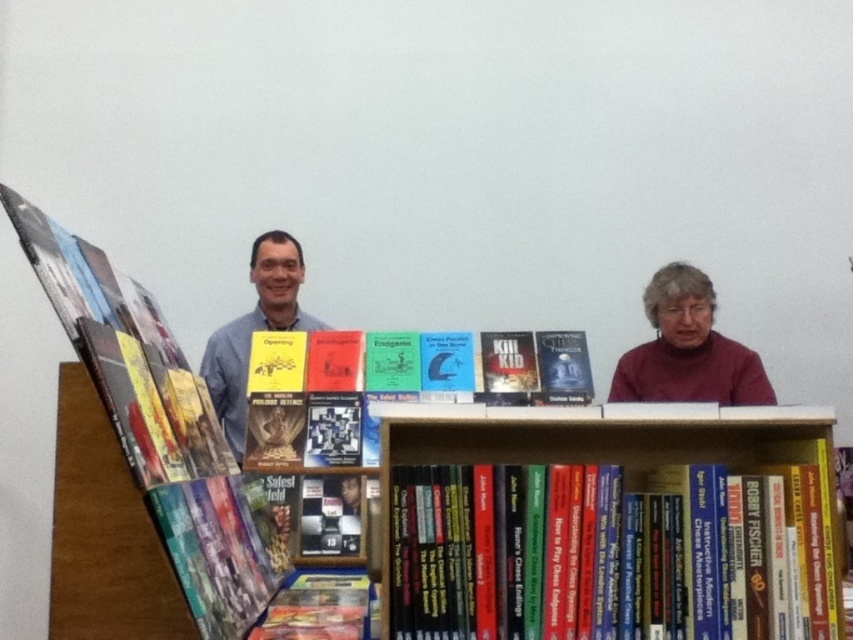
You are a photographer standing in front of the bookshelf and want to take a photo of both the maroon sweater at upper right and the blue shirt at center. Which object should you focus on first to ensure both are in sharp focus?

You should focus on the maroon sweater at upper right first because it is closer to you than the blue shirt at center, ensuring both will be in focus when focused on the closer object.

You are a photographer trying to capture a clear shot of the hardcover book at lower center without the maroon sweater at upper right blocking it. Given their sizes, which object would require more space in the frame?

The maroon sweater at upper right requires more space in the frame since it is larger in size than the hardcover book at lower center.

You are organizing a book display on the top shelf of the wooden bookshelf. You have two books to place next to the maroon sweater at upper right and the blue shirt at center. Which book should you place closer to the edge of the shelf to ensure visibility?

The maroon sweater at upper right is shorter than the blue shirt at center, so placing the book next to the blue shirt at center will ensure better visibility since it is taller.